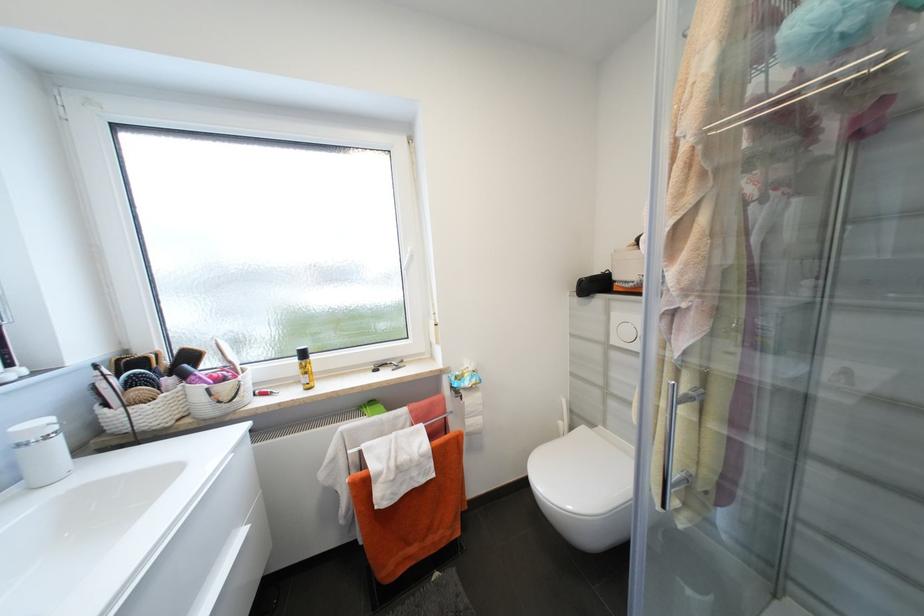
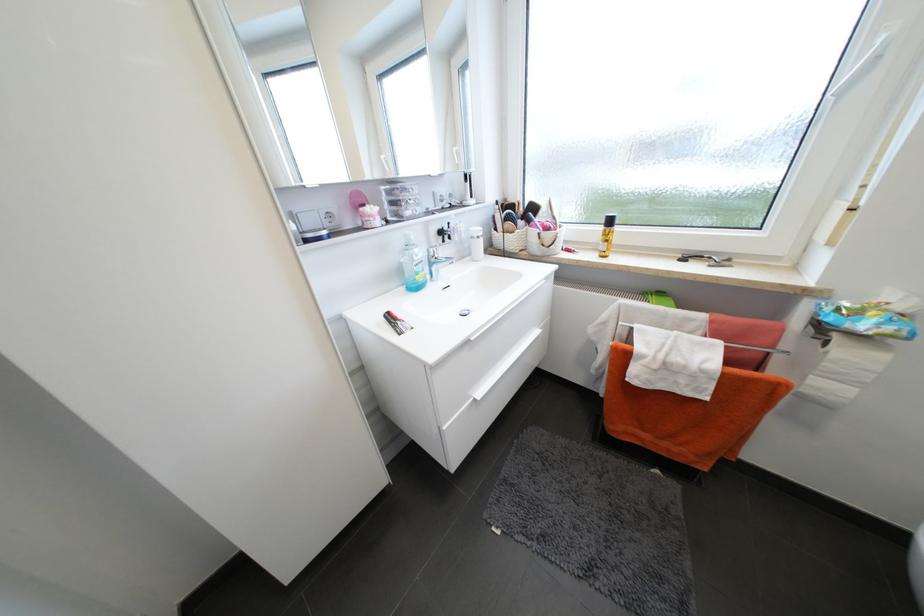
Where in the second image is the point corresponding to (213,391) from the first image?

(544, 235)